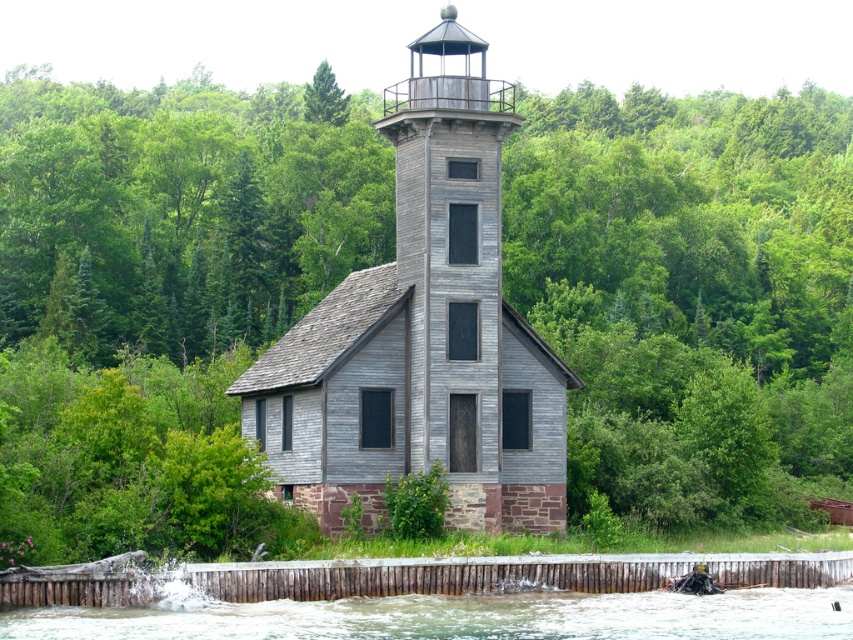
Does gray wood tower at center have a greater height compared to white frothy water at lower center?

Indeed, gray wood tower at center has a greater height compared to white frothy water at lower center.

Looking at this image, does gray wood tower at center appear over white frothy water at lower center?

Yes.

What are the coordinates of `gray wood tower at center` in the screenshot? It's located at (422, 333).

Locate an element on the screen. gray wood tower at center is located at coordinates (422, 333).